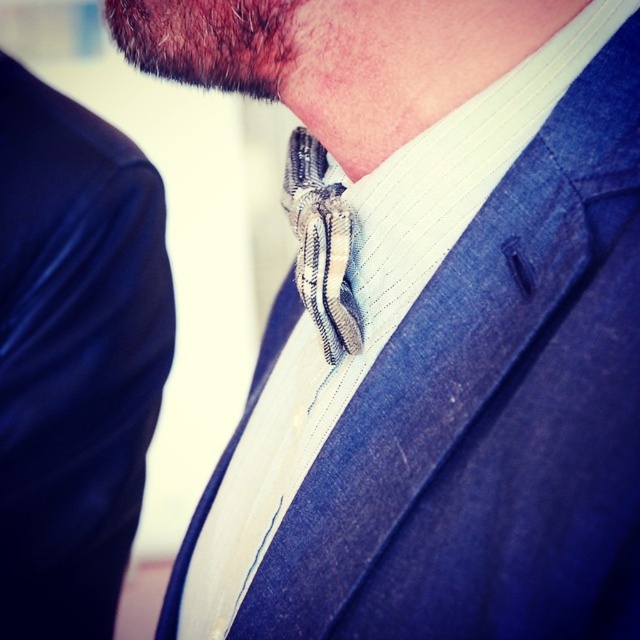
You are a tailor adjusting the fit of a suit jacket. You notice two points on the jacket. One is at coordinate point (460, 321) and the other at point (90, 481). Which point is positioned closer to you?

Point (460, 321) is closer to the viewer than point (90, 481).

You are a tailor measuring a customer for alterations. You need to ensure there is enough space between the white striped dress shirt at center and the blue denim jacket at left for the customer to move comfortably. The minimum required space is 18 inches. Is the current distance sufficient?

The distance between the white striped dress shirt at center and the blue denim jacket at left is 19.03 inches, which exceeds the minimum required 18 inches. Therefore, the current spacing is sufficient for comfortable movement.

You are a tailor measuring a customer for a new suit. You notice the white striped dress shirt at center and the blue denim jacket at left. Which garment has a larger size according to the image?

The white striped dress shirt at center has a larger size compared to the blue denim jacket at left, so the shirt is larger.